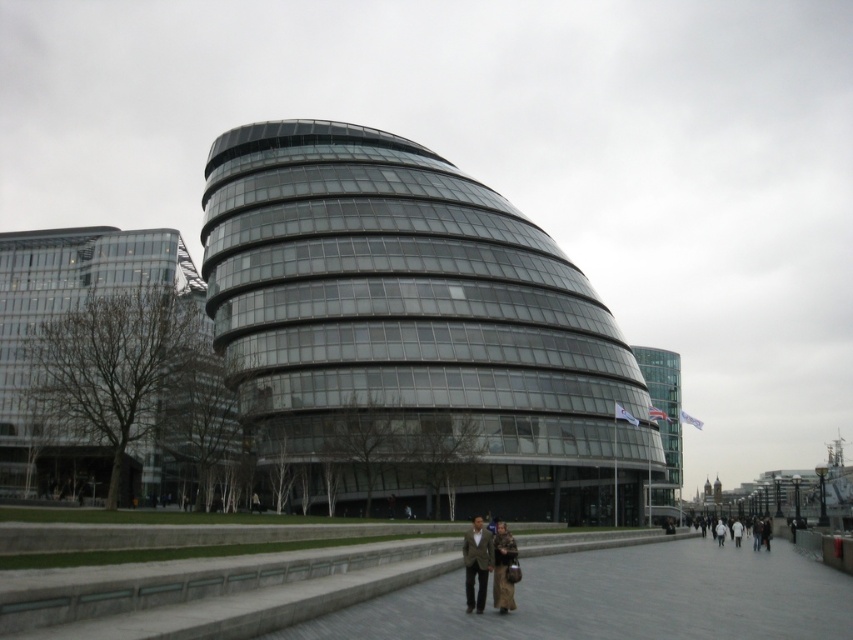
Question: Is transparent glass building at center bigger than matte brown coat at center?

Choices:
 (A) no
 (B) yes

Answer: (B)

Question: Which is farther from the transparent glass building at center?

Choices:
 (A) brown leather coat at center
 (B) brown textured coat at center

Answer: (B)

Question: Does brown leather coat at center appear on the left side of matte brown coat at center?

Choices:
 (A) no
 (B) yes

Answer: (B)

Question: Which of the following is the farthest from the observer?

Choices:
 (A) (469, 593)
 (B) (756, 532)
 (C) (503, 582)
 (D) (221, 330)

Answer: (B)

Question: Observing the image, what is the correct spatial positioning of transparent glass building at center in reference to matte brown coat at center?

Choices:
 (A) below
 (B) above

Answer: (B)

Question: Which point appears closest to the camera in this image?

Choices:
 (A) (236, 294)
 (B) (758, 536)
 (C) (469, 595)

Answer: (C)